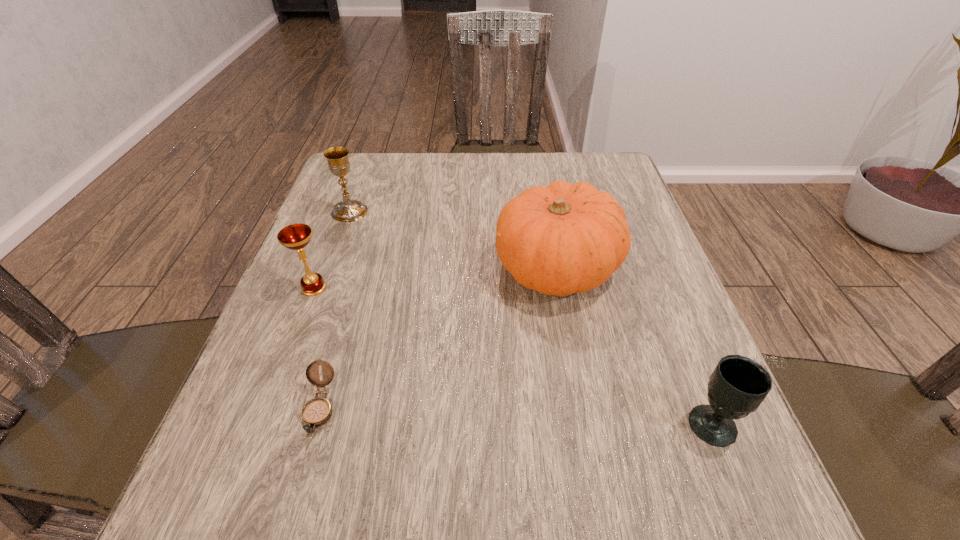
This screenshot has height=540, width=960. Find the location of `vacant space located 0.050m on the face of the compass`. vacant space located 0.050m on the face of the compass is located at coordinates (300, 476).

Where is `compass present at the left edge`? The height and width of the screenshot is (540, 960). compass present at the left edge is located at coordinates (316, 412).

You are a GUI agent. You are given a task and a screenshot of the screen. Output one action in this format:
    pyautogui.click(x=<x>, y=<y>)
    Task: Click on the pumpkin situated at the right edge
    The height and width of the screenshot is (540, 960).
    Given the screenshot: What is the action you would take?
    pyautogui.click(x=561, y=239)

This screenshot has height=540, width=960. Identify the location of chalice that is at the right edge. (738, 385).

This screenshot has width=960, height=540. In the image, there is a desktop. In order to click on vacant space at the far edge in this screenshot , I will do `click(462, 192)`.

The height and width of the screenshot is (540, 960). What are the coordinates of `vacant space at the left edge of the desktop` in the screenshot? It's located at (294, 305).

In the image, there is a desktop. Where is `vacant region at the right edge`? Image resolution: width=960 pixels, height=540 pixels. vacant region at the right edge is located at coordinates (608, 337).

Identify the location of blank space at the far left corner of the desktop. (393, 171).

Identify the location of free space at the near left corner. Image resolution: width=960 pixels, height=540 pixels. (225, 515).

In the image, there is a desktop. Where is `vacant space at the far right corner`? This screenshot has height=540, width=960. vacant space at the far right corner is located at coordinates (576, 170).